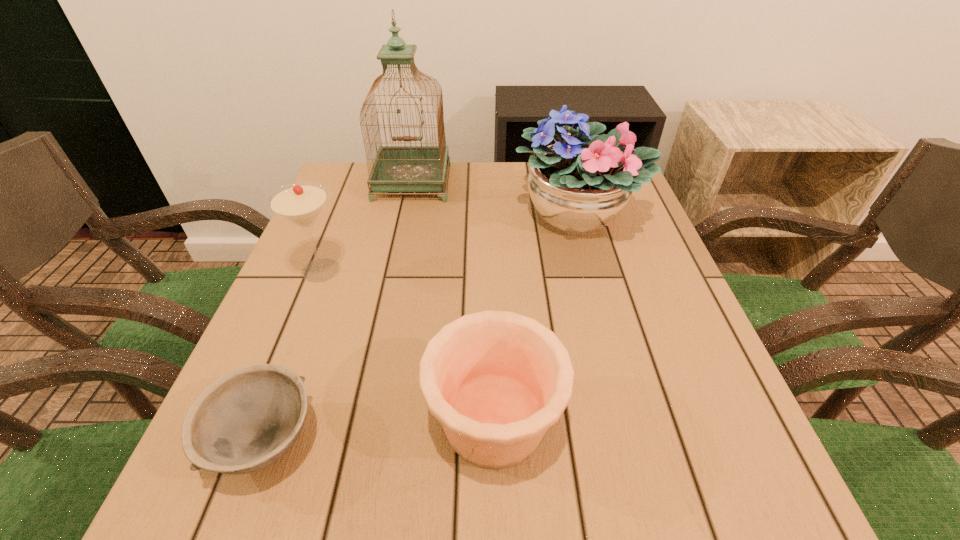
The width and height of the screenshot is (960, 540). Find the location of `vacant space that satisfies the following two spatial constraints: 1. at the door of the second shortest object; 2. on the right side of the tallest object`. vacant space that satisfies the following two spatial constraints: 1. at the door of the second shortest object; 2. on the right side of the tallest object is located at coordinates (362, 419).

Locate an element on the screen. The height and width of the screenshot is (540, 960). free space that satisfies the following two spatial constraints: 1. at the door of the birdcage; 2. on the left side of the pottery is located at coordinates (362, 419).